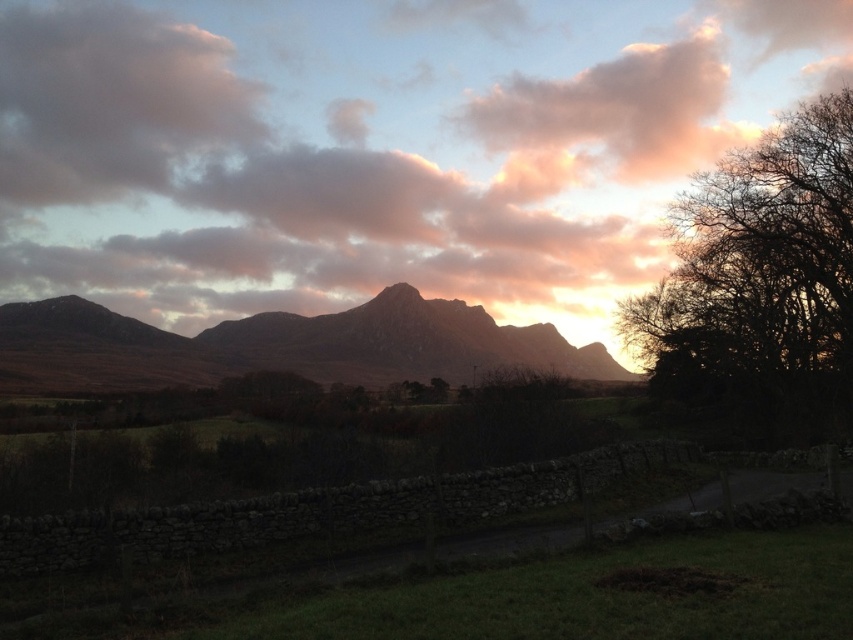
From the picture: You are standing on the road near the stone wall and want to take a photo of both the pink fluffy cloud at upper center and the rugged brown mountain at center. Can you fit both into your camera frame if your camera has a 50mm lens? Explain why or why not.

The distance between the pink fluffy cloud at upper center and rugged brown mountain at center is 64.64 meters. A 50mm lens has a field of view that can typically capture objects within a certain distance apart, but since the cloud and mountain are 64.64 meters apart, it depends on the camera sensor size and shooting distance. However, without knowing the exact sensor size or distance from the subject, it is difficult to definitively say. But given typical conditions, a 50mm lens might struggle to capture 6

You are an artist trying to paint the scene. You want to ensure the pink fluffy cloud at upper center and rugged brown mountain at center are proportionally accurate. Which object should you make wider in your painting?

The pink fluffy cloud at upper center should be made wider than the rugged brown mountain at center because its width surpasses the mountain.

You are standing at the camera position looking at the rural landscape. There is a point at coordinates point (109, 97). Can you determine if this point is closer to you or farther away than 200 meters?

The distance between point (109, 97) and the camera is 209.75 meters, so the point is farther away than 200 meters.